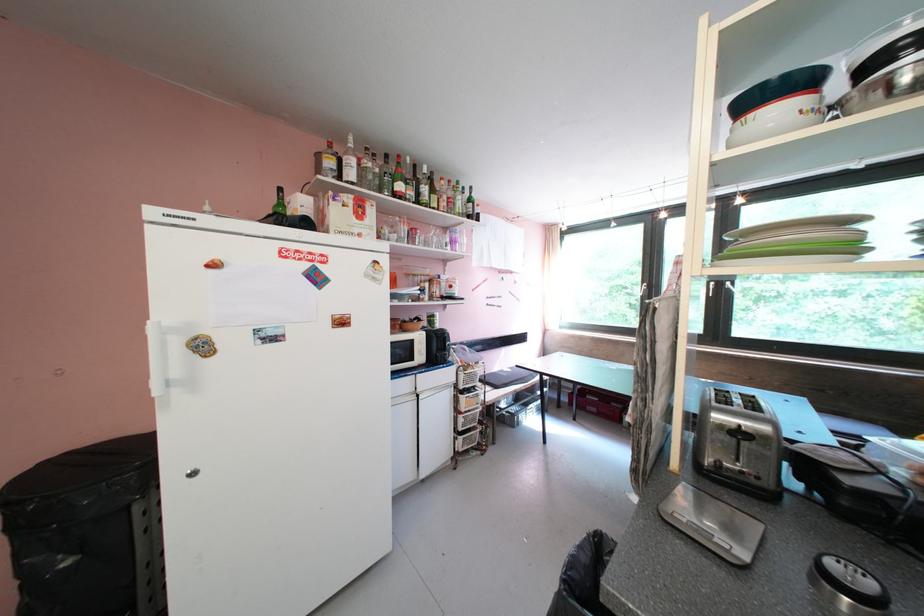
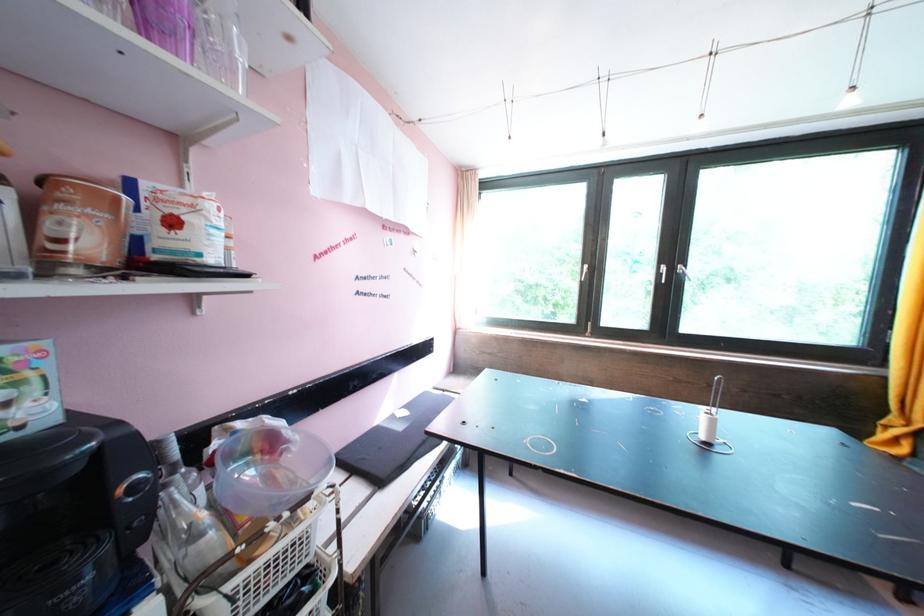
Question: I am providing you with two images of the same scene from different viewpoints. Which of the following objects are not visible in image2?

Choices:
 (A) clear plastic bowl
 (B) brown coffee container
 (C) purple plastic cup
 (D) none of these

Answer: (D)